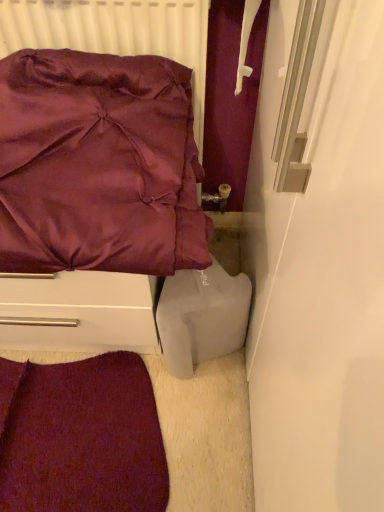
Locate an element on the screen. matte white radiator at upper left is located at coordinates (115, 33).

The width and height of the screenshot is (384, 512). In order to click on satin purple pillow at upper left in this screenshot , I will do `click(94, 196)`.

Considering the relative positions of satin purple pillow at upper left and matte white radiator at upper left in the image provided, is satin purple pillow at upper left to the left or to the right of matte white radiator at upper left?

In the image, satin purple pillow at upper left appears on the left side of matte white radiator at upper left.

Image resolution: width=384 pixels, height=512 pixels. Identify the location of furniture that appears below the matte white radiator at upper left (from the image's perspective). pyautogui.click(x=94, y=196).

Is satin purple pillow at upper left not near matte white radiator at upper left?

satin purple pillow at upper left is actually quite close to matte white radiator at upper left.

How different are the orientations of satin purple pillow at upper left and matte white radiator at upper left in degrees?

The angle between the facing direction of satin purple pillow at upper left and the facing direction of matte white radiator at upper left is 1.26 degrees.

Based on the photo, how far apart are satin purple pillow at upper left and white matte plastic container at lower right?

satin purple pillow at upper left and white matte plastic container at lower right are 8.92 inches apart from each other.

Locate an element on the screen. The width and height of the screenshot is (384, 512). furniture in front of the white matte plastic container at lower right is located at coordinates [x=94, y=196].

Is satin purple pillow at upper left smaller than white matte plastic container at lower right?

Incorrect, satin purple pillow at upper left is not smaller in size than white matte plastic container at lower right.

Considering the points (119, 276) and (198, 315), which point is behind, point (119, 276) or point (198, 315)?

The point (198, 315) is more distant.

From the image's perspective, relative to velvet carpet at lower left, is matte white radiator at upper left above or below?

matte white radiator at upper left is situated higher than velvet carpet at lower left in the image.

Considering the sizes of objects matte white radiator at upper left and velvet carpet at lower left in the image provided, who is bigger, matte white radiator at upper left or velvet carpet at lower left?

matte white radiator at upper left.

Is matte white radiator at upper left turned away from velvet carpet at lower left?

No, matte white radiator at upper left is not facing the opposite direction of velvet carpet at lower left.

In the scene shown: Is velvet carpet at lower left surrounded by matte white radiator at upper left?

No, velvet carpet at lower left is located outside of matte white radiator at upper left.

Is velvet carpet at lower left located outside satin purple pillow at upper left?

Yes, velvet carpet at lower left is located beyond the bounds of satin purple pillow at upper left.

Could you tell me if velvet carpet at lower left is facing satin purple pillow at upper left?

No, velvet carpet at lower left does not turn towards satin purple pillow at upper left.

From a real-world perspective, is velvet carpet at lower left located beneath satin purple pillow at upper left?

Indeed, from a real-world perspective, velvet carpet at lower left is positioned beneath satin purple pillow at upper left.

Does velvet carpet at lower left have a smaller size compared to satin purple pillow at upper left?

Yes, velvet carpet at lower left is smaller than satin purple pillow at upper left.

Would you say matte white radiator at upper left is to the left or to the right of white matte plastic container at lower right in the picture?

In the image, matte white radiator at upper left appears on the left side of white matte plastic container at lower right.

Is matte white radiator at upper left positioned beyond the bounds of white matte plastic container at lower right?

Indeed, matte white radiator at upper left is completely outside white matte plastic container at lower right.

Is matte white radiator at upper left wider or thinner than white matte plastic container at lower right?

Clearly, matte white radiator at upper left has less width compared to white matte plastic container at lower right.

How different are the orientations of matte white radiator at upper left and white matte plastic container at lower right in degrees?

matte white radiator at upper left and white matte plastic container at lower right are facing 0.858 degrees away from each other.

Identify the location of violet located on the left of white matte plastic container at lower right. (81, 437).

Measure the distance between velvet carpet at lower left and white matte plastic container at lower right.

velvet carpet at lower left is 10.78 inches away from white matte plastic container at lower right.

Is velvet carpet at lower left positioned behind white matte plastic container at lower right?

Yes, the depth of velvet carpet at lower left is greater than that of white matte plastic container at lower right.

From the picture: Choose the correct answer: Is velvet carpet at lower left inside white matte plastic container at lower right or outside it?

velvet carpet at lower left is spatially situated outside white matte plastic container at lower right.

Is white matte plastic container at lower right looking in the opposite direction of satin purple pillow at upper left?

No, white matte plastic container at lower right's orientation is not away from satin purple pillow at upper left.

Based on the photo, considering the positions of objects white matte plastic container at lower right and satin purple pillow at upper left in the image provided, who is more to the left, white matte plastic container at lower right or satin purple pillow at upper left?

From the viewer's perspective, satin purple pillow at upper left appears more on the left side.

From the image's perspective, which one is positioned higher, white matte plastic container at lower right or satin purple pillow at upper left?

satin purple pillow at upper left is shown above in the image.

Considering the sizes of objects white matte plastic container at lower right and satin purple pillow at upper left in the image provided, who is bigger, white matte plastic container at lower right or satin purple pillow at upper left?

satin purple pillow at upper left is bigger.

In the image, there is a satin purple pillow at upper left. Where is `radiator above it (from the image's perspective)`? The image size is (384, 512). radiator above it (from the image's perspective) is located at coordinates (115, 33).

At what (x,y) coordinates should I click in order to perform the action: click on furniture in front of the white matte plastic container at lower right. Please return your answer as a coordinate pair (x, y). Looking at the image, I should click on (94, 196).

From the image, which object appears to be farther from matte white radiator at upper left, velvet carpet at lower left or white matte plastic container at lower right?

Among the two, velvet carpet at lower left is located further to matte white radiator at upper left.

In the scene shown: Which object lies nearer to the anchor point satin purple pillow at upper left, velvet carpet at lower left or matte white radiator at upper left?

Among the two, matte white radiator at upper left is located nearer to satin purple pillow at upper left.

From the picture: Considering their positions, is matte white radiator at upper left positioned further to velvet carpet at lower left than white matte plastic container at lower right?

Based on the image, matte white radiator at upper left appears to be further to velvet carpet at lower left.

Considering their positions, is satin purple pillow at upper left positioned closer to matte white radiator at upper left than velvet carpet at lower left?

satin purple pillow at upper left lies closer to matte white radiator at upper left than the other object.

Looking at the image, which one is located closer to matte white radiator at upper left, white matte plastic container at lower right or velvet carpet at lower left?

white matte plastic container at lower right is positioned closer to the anchor matte white radiator at upper left.

Estimate the real-world distances between objects in this image. Which object is closer to satin purple pillow at upper left, white matte plastic container at lower right or velvet carpet at lower left?

white matte plastic container at lower right is closer to satin purple pillow at upper left.

Considering their positions, is satin purple pillow at upper left positioned further to white matte plastic container at lower right than velvet carpet at lower left?

velvet carpet at lower left is positioned further to the anchor white matte plastic container at lower right.

When comparing their distances from velvet carpet at lower left, does white matte plastic container at lower right or matte white radiator at upper left seem closer?

white matte plastic container at lower right is positioned closer to the anchor velvet carpet at lower left.

This screenshot has width=384, height=512. I want to click on wide that lies between satin purple pillow at upper left and velvet carpet at lower left from top to bottom, so click(x=202, y=316).

You are a GUI agent. You are given a task and a screenshot of the screen. Output one action in this format:
    pyautogui.click(x=<x>, y=<y>)
    Task: Click on the furniture between matte white radiator at upper left and velvet carpet at lower left in the vertical direction
    
    Given the screenshot: What is the action you would take?
    pyautogui.click(x=94, y=196)

Image resolution: width=384 pixels, height=512 pixels. I want to click on furniture between matte white radiator at upper left and white matte plastic container at lower right from top to bottom, so click(x=94, y=196).

Identify the location of wide that lies between matte white radiator at upper left and velvet carpet at lower left from top to bottom. Image resolution: width=384 pixels, height=512 pixels. click(x=202, y=316).